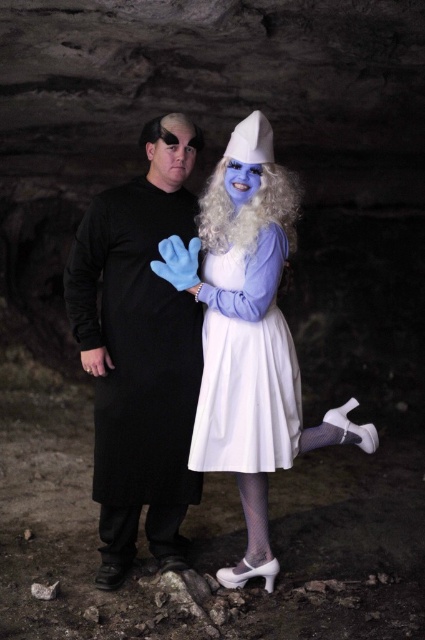
Question: Where is matte blue dress at center located in relation to white curly wig at center in the image?

Choices:
 (A) right
 (B) left

Answer: (B)

Question: Does white satin dress at center have a larger size compared to white curly wig at center?

Choices:
 (A) no
 (B) yes

Answer: (B)

Question: Does black matte coat at left have a smaller size compared to white curly wig at center?

Choices:
 (A) no
 (B) yes

Answer: (A)

Question: Which point appears closest to the camera in this image?

Choices:
 (A) (289, 416)
 (B) (299, 195)
 (C) (149, 324)

Answer: (A)

Question: Among these objects, which one is nearest to the camera?

Choices:
 (A) white curly wig at center
 (B) white satin dress at center

Answer: (B)

Question: Which of the following is the farthest from the observer?

Choices:
 (A) (280, 355)
 (B) (195, 314)

Answer: (B)